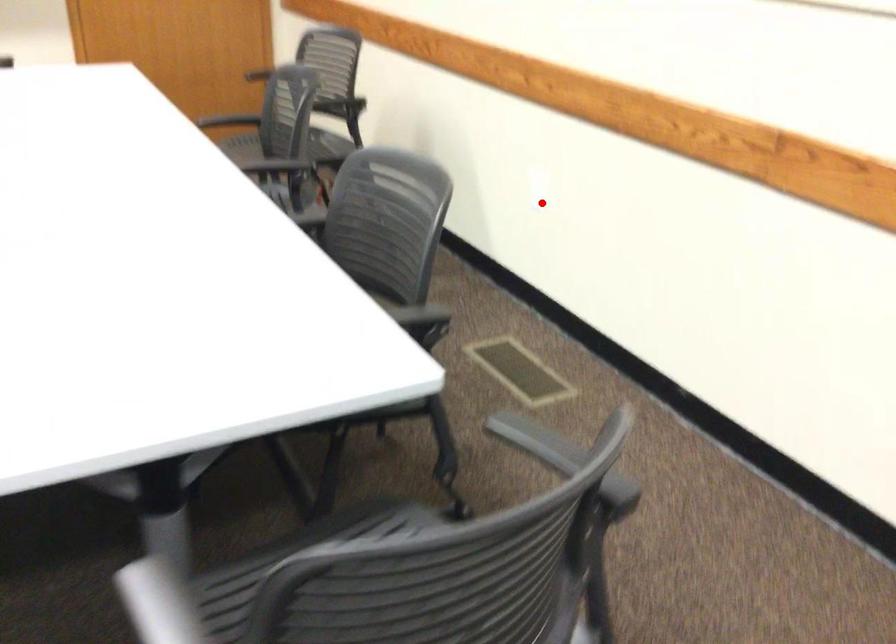
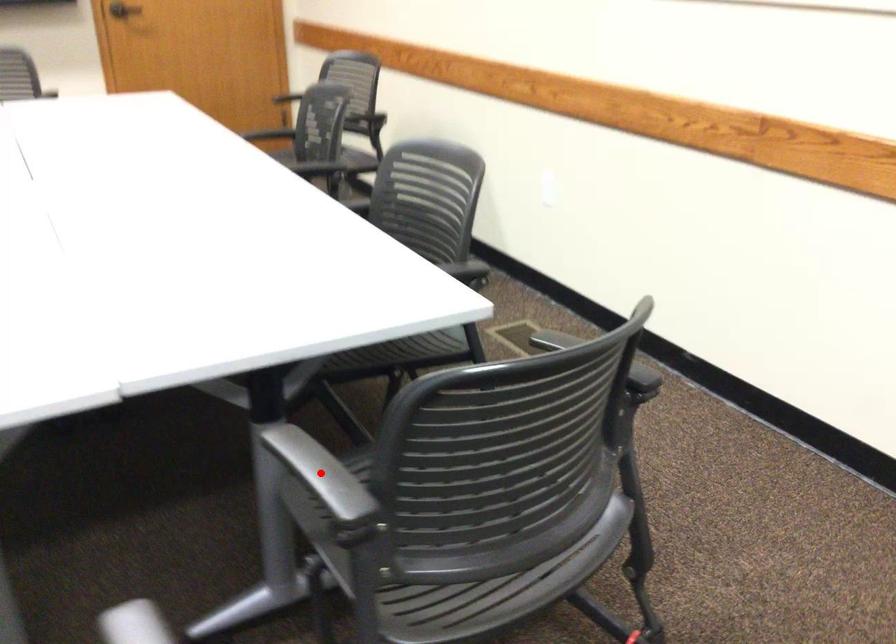
I am providing you with two images of the same scene from different viewpoints. A red point is marked on the first image and another point is marked on the second image. Are the points marked in image1 and image2 representing the same 3D position?

No